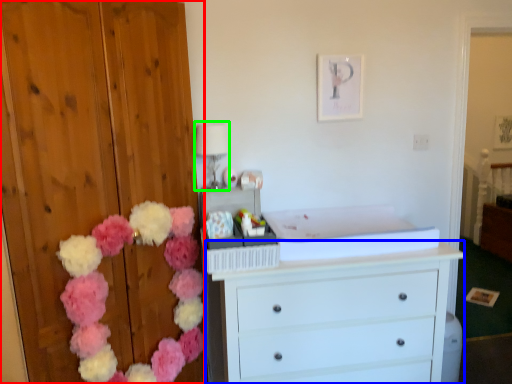
Question: Which object is the farthest from dresser (highlighted by a red box)? Choose among these: chest of drawers (highlighted by a blue box) or lamp (highlighted by a green box).

Choices:
 (A) chest of drawers
 (B) lamp

Answer: (A)